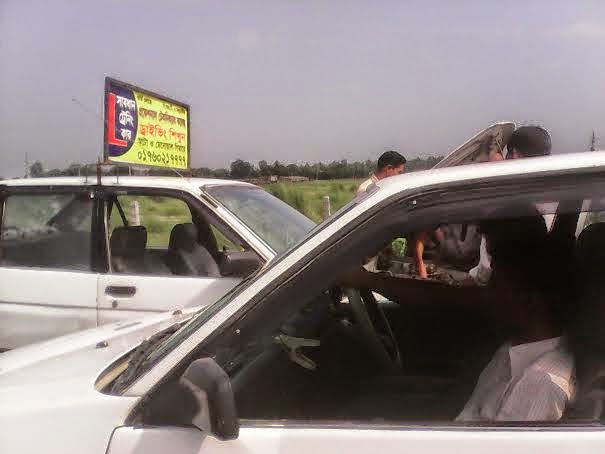
Locate an element on the screen. door lock is located at coordinates (111, 306).